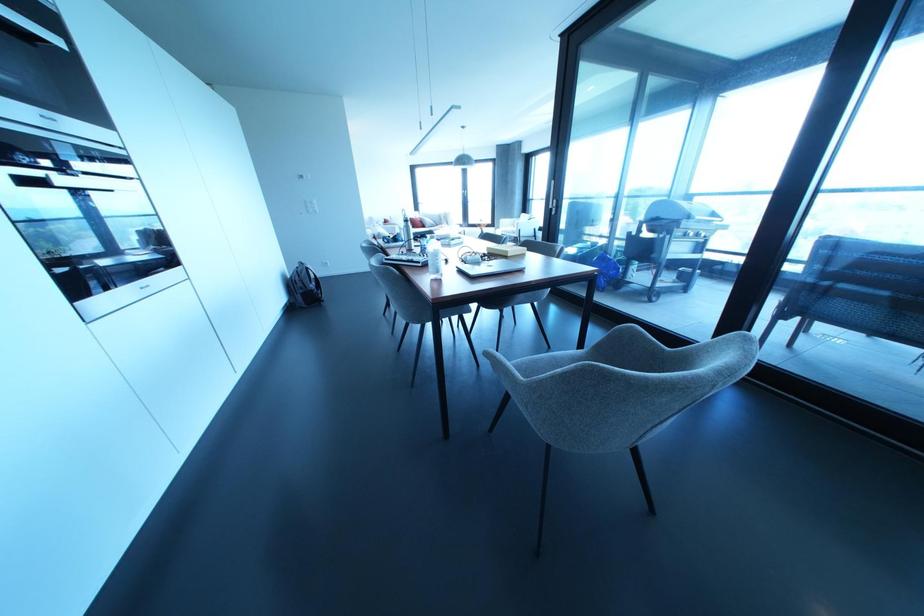
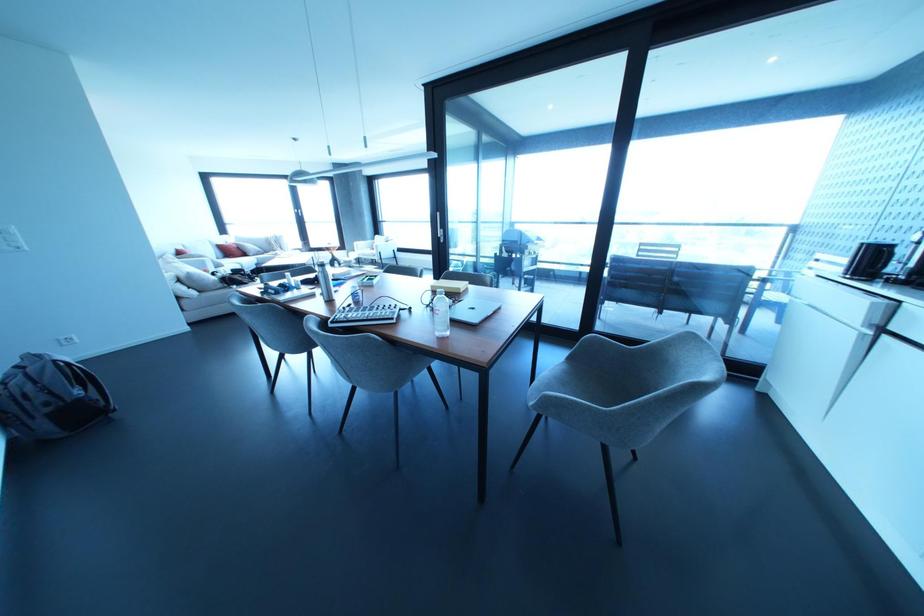
The point at (427,220) is marked in the first image. Where is the corresponding point in the second image?

(249, 246)